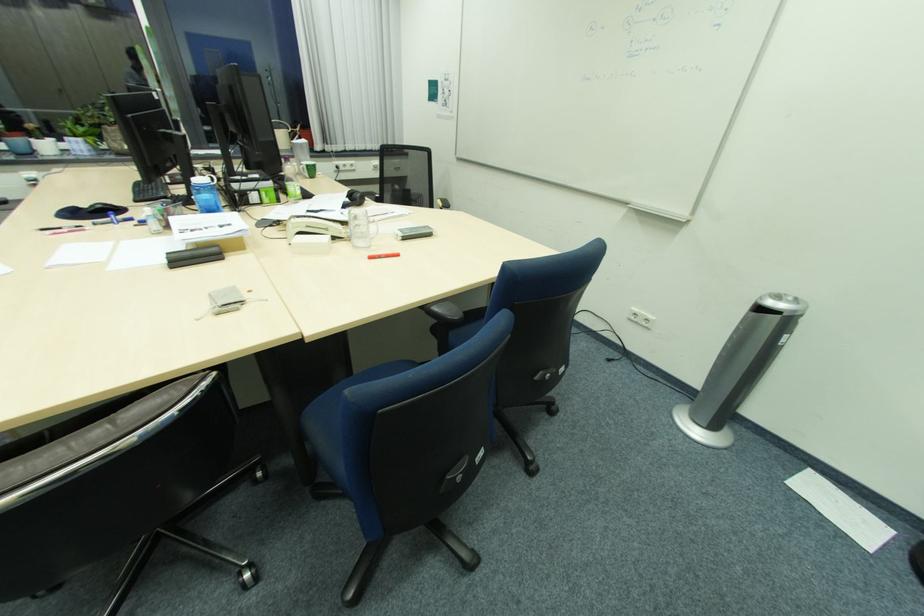
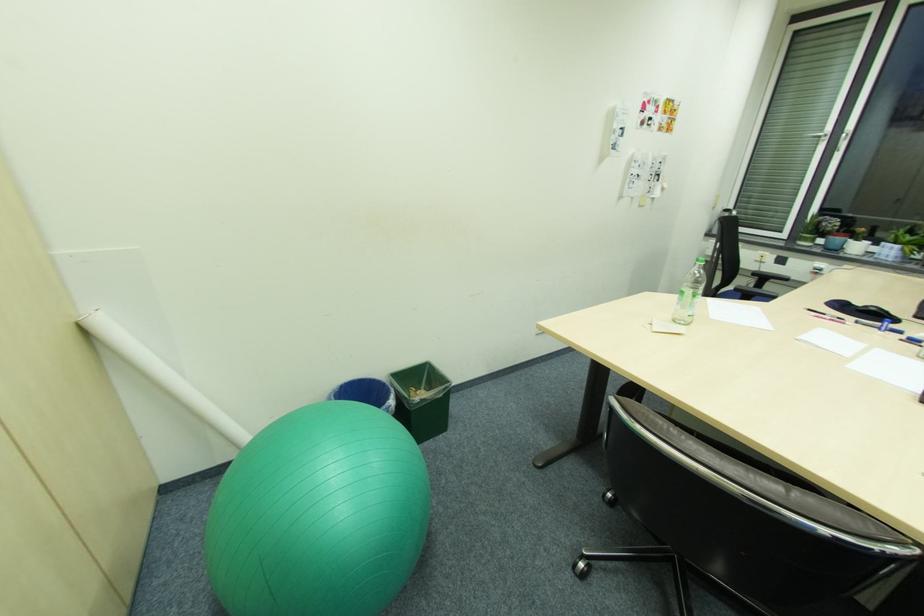
Locate, in the second image, the point that corresponds to (106,207) in the first image.

(879, 310)